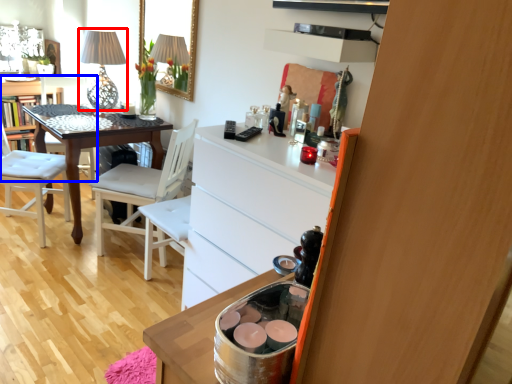
Question: Among these objects, which one is farthest to the camera, table lamp (highlighted by a red box) or chair (highlighted by a blue box)?

Choices:
 (A) table lamp
 (B) chair

Answer: (B)